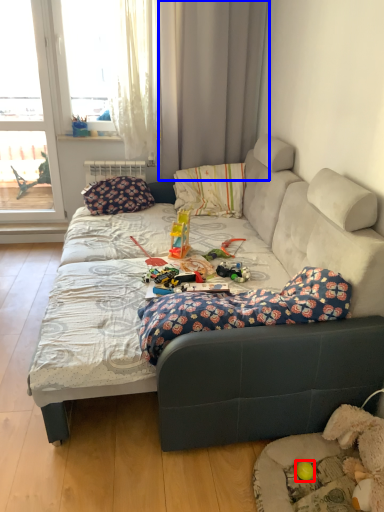
Question: Which object is further to the camera taking this photo, toy (highlighted by a red box) or curtain (highlighted by a blue box)?

Choices:
 (A) toy
 (B) curtain

Answer: (B)